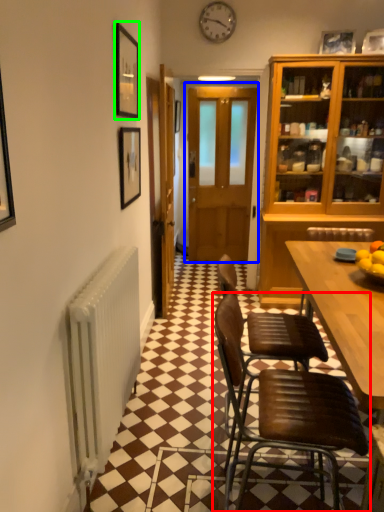
Question: Considering the real-world distances, which object is farthest from chair (highlighted by a red box)? door (highlighted by a blue box) or picture frame (highlighted by a green box)?

Choices:
 (A) door
 (B) picture frame

Answer: (A)